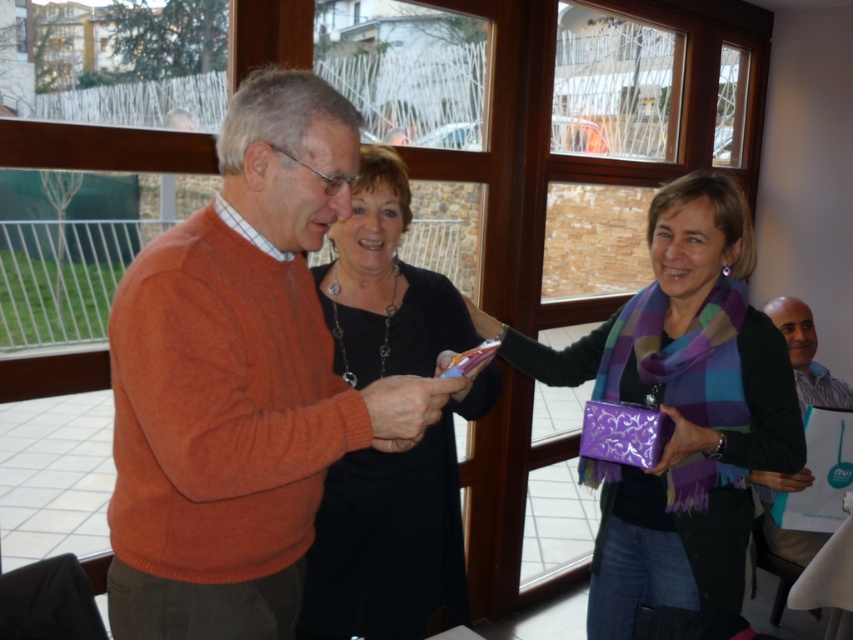
In the scene shown: Can you confirm if black matte dress at center is taller than purple shiny gift bag at center?

Indeed, black matte dress at center has a greater height compared to purple shiny gift bag at center.

Who is more distant from viewer, (x=413, y=458) or (x=587, y=444)?

Point (x=587, y=444)

Find the location of a particular element. The width and height of the screenshot is (853, 640). black matte dress at center is located at coordinates (393, 534).

Is point (668, 198) positioned in front of point (791, 474)?

Yes.

Which is behind, point (693, 456) or point (799, 364)?

The point (799, 364) is behind.

You are a GUI agent. You are given a task and a screenshot of the screen. Output one action in this format:
    pyautogui.click(x=<x>, y=<y>)
    Task: Click on the matte purple gift bag at right
    This screenshot has height=640, width=853.
    Given the screenshot: What is the action you would take?
    pyautogui.click(x=679, y=408)

Does matte purple gift bag at right appear under purple shiny gift bag at center?

No.

Does matte purple gift bag at right have a lesser height compared to purple shiny gift bag at center?

No.

Who is more distant from viewer, (x=674, y=518) or (x=643, y=426)?

Positioned behind is point (x=674, y=518).

Identify the location of matte purple gift bag at right. The height and width of the screenshot is (640, 853). (679, 408).